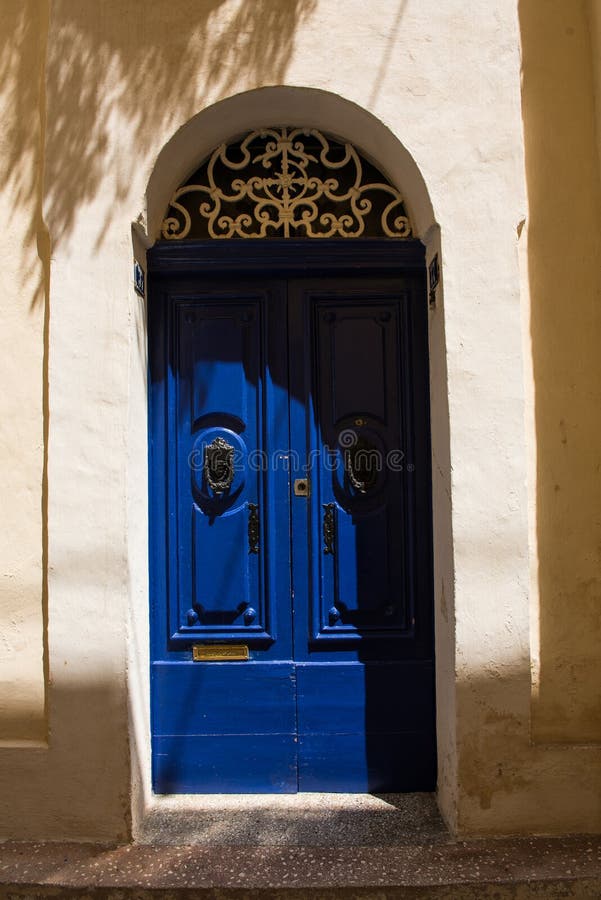
You are a GUI agent. You are given a task and a screenshot of the screen. Output one action in this format:
    pyautogui.click(x=<x>, y=<y>)
    Task: Click on the door handle
    The image size is (601, 900).
    Given the screenshot: What is the action you would take?
    pyautogui.click(x=357, y=482), pyautogui.click(x=221, y=486)